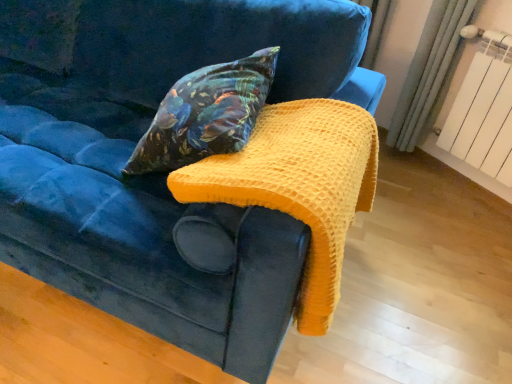
Question: From a real-world perspective, is yellow waffle knit blanket at upper center positioned above or below white painted metal radiator at upper right?

Choices:
 (A) below
 (B) above

Answer: (B)

Question: Is point (285, 205) positioned closer to the camera than point (508, 92)?

Choices:
 (A) closer
 (B) farther

Answer: (A)

Question: Considering the real-world distances, which object is farthest from the velvet floral pillow at center?

Choices:
 (A) yellow waffle knit blanket at upper center
 (B) white painted metal radiator at upper right

Answer: (B)

Question: Based on their relative distances, which object is nearer to the velvet floral pillow at center?

Choices:
 (A) white painted metal radiator at upper right
 (B) yellow waffle knit blanket at upper center

Answer: (B)